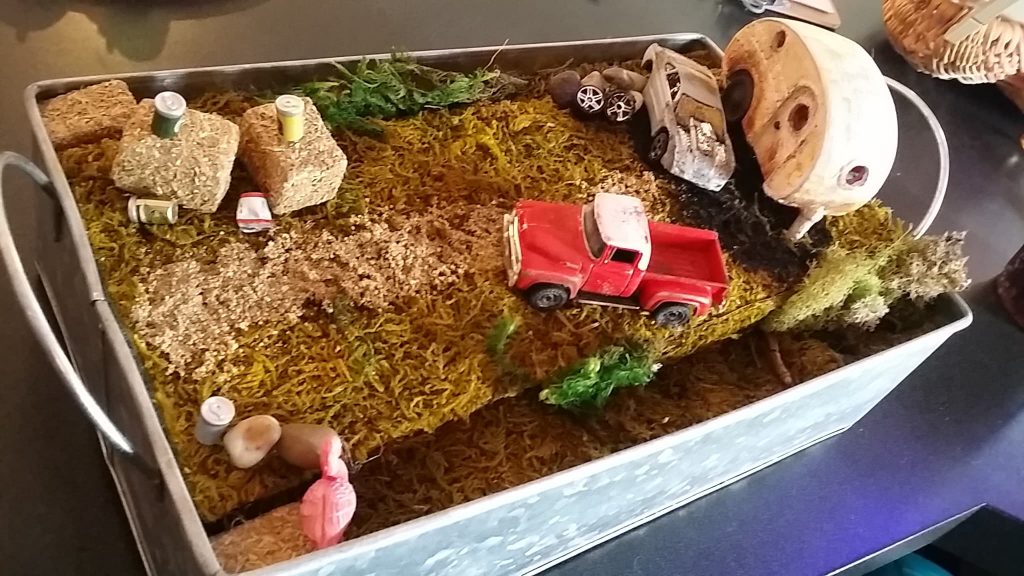
You are a GUI agent. You are given a task and a screenshot of the screen. Output one action in this format:
    pyautogui.click(x=<x>, y=<y>)
    Task: Click on the plant
    Image resolution: width=1024 pixels, height=576 pixels.
    Given the screenshot: What is the action you would take?
    pyautogui.click(x=840, y=281), pyautogui.click(x=868, y=283), pyautogui.click(x=868, y=222), pyautogui.click(x=597, y=381), pyautogui.click(x=508, y=338), pyautogui.click(x=370, y=104)